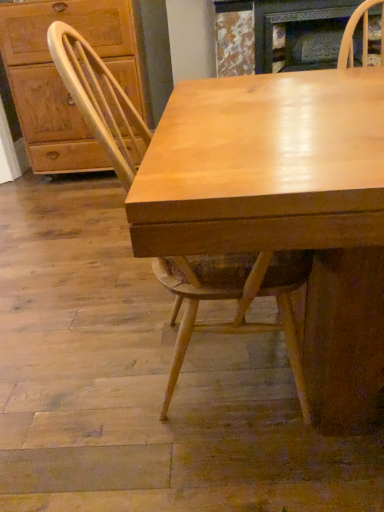
Question: Considering the relative sizes of matte wood cabinet at left and light wood chair at center in the image provided, is matte wood cabinet at left wider than light wood chair at center?

Choices:
 (A) no
 (B) yes

Answer: (A)

Question: Can you confirm if matte wood cabinet at left is taller than light wood chair at center?

Choices:
 (A) yes
 (B) no

Answer: (A)

Question: From the image's perspective, is matte wood cabinet at left on top of light wood chair at center?

Choices:
 (A) no
 (B) yes

Answer: (B)

Question: From a real-world perspective, is matte wood cabinet at left beneath light wood chair at center?

Choices:
 (A) no
 (B) yes

Answer: (A)

Question: From the image's perspective, does matte wood cabinet at left appear lower than light wood chair at center?

Choices:
 (A) no
 (B) yes

Answer: (A)

Question: In terms of width, does light wood chair at center look wider or thinner when compared to matte wood cabinet at left?

Choices:
 (A) thin
 (B) wide

Answer: (B)

Question: Is light wood chair at center taller or shorter than matte wood cabinet at left?

Choices:
 (A) tall
 (B) short

Answer: (B)

Question: From a real-world perspective, relative to matte wood cabinet at left, is light wood chair at center vertically above or below?

Choices:
 (A) above
 (B) below

Answer: (B)

Question: Is point (94, 100) closer or farther from the camera than point (13, 95)?

Choices:
 (A) farther
 (B) closer

Answer: (B)

Question: Do you think marble textured fireplace at upper center is within light wood chair at center, or outside of it?

Choices:
 (A) outside
 (B) inside

Answer: (A)

Question: Considering the positions of marble textured fireplace at upper center and light wood chair at center in the image, is marble textured fireplace at upper center bigger or smaller than light wood chair at center?

Choices:
 (A) big
 (B) small

Answer: (B)

Question: Considering the positions of marble textured fireplace at upper center and light wood chair at center in the image, is marble textured fireplace at upper center wider or thinner than light wood chair at center?

Choices:
 (A) wide
 (B) thin

Answer: (B)

Question: Would you say marble textured fireplace at upper center is to the left or to the right of light wood chair at center in the picture?

Choices:
 (A) left
 (B) right

Answer: (B)

Question: From the image's perspective, is marble textured fireplace at upper center above or below matte wood cabinet at left?

Choices:
 (A) above
 (B) below

Answer: (A)

Question: In terms of width, does marble textured fireplace at upper center look wider or thinner when compared to matte wood cabinet at left?

Choices:
 (A) wide
 (B) thin

Answer: (B)